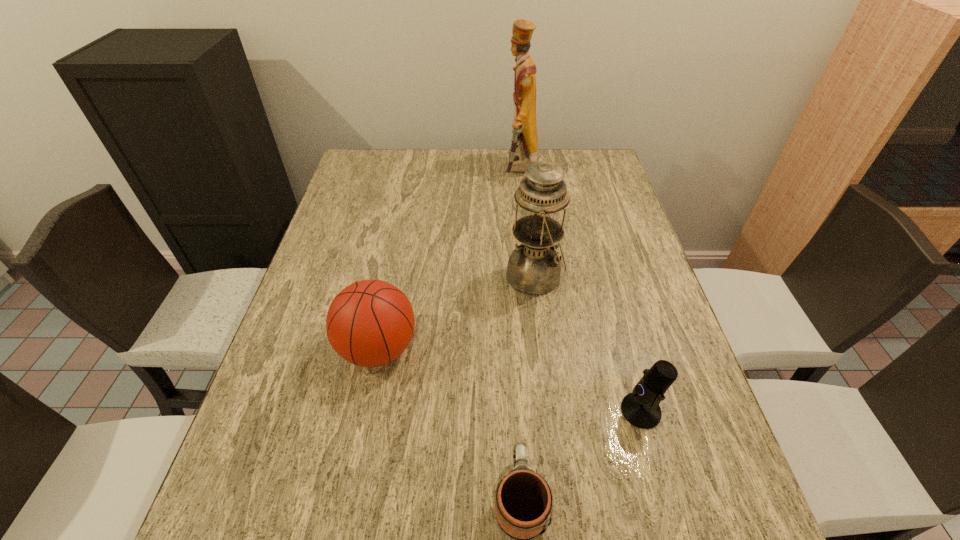
Where is `blank space at the near edge of the desktop`? This screenshot has width=960, height=540. blank space at the near edge of the desktop is located at coordinates (636, 536).

Locate an element on the screen. free space at the left edge of the desktop is located at coordinates (293, 433).

The width and height of the screenshot is (960, 540). In the image, there is a desktop. Identify the location of vacant space at the right edge. (654, 494).

Locate an element on the screen. free space at the far left corner of the desktop is located at coordinates (391, 175).

What are the coordinates of `free space between the rightmost object and the third farthest object` in the screenshot? It's located at (510, 380).

Locate an element on the screen. vacant point located between the second tallest object and the leftmost object is located at coordinates (457, 313).

Where is `empty location between the farthest object and the microphone`? The height and width of the screenshot is (540, 960). empty location between the farthest object and the microphone is located at coordinates (580, 291).

This screenshot has height=540, width=960. I want to click on free spot between the tallest object and the rightmost object, so click(580, 291).

Find the location of a particular element. free spot between the third farthest object and the oil lamp is located at coordinates (457, 313).

At what (x,y) coordinates should I click in order to perform the action: click on object identified as the third closest to the farthest object. Please return your answer as a coordinate pair (x, y). Looking at the image, I should click on (640, 408).